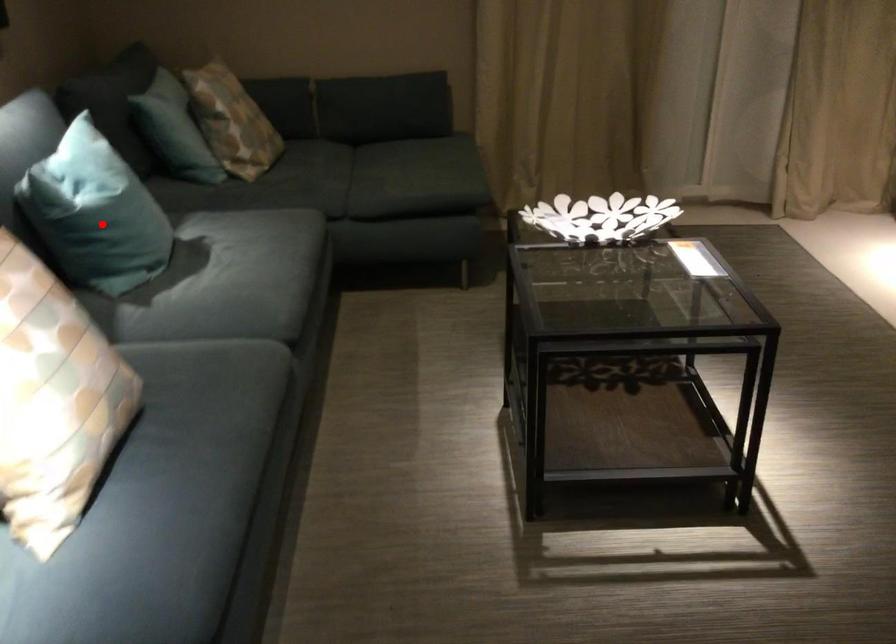
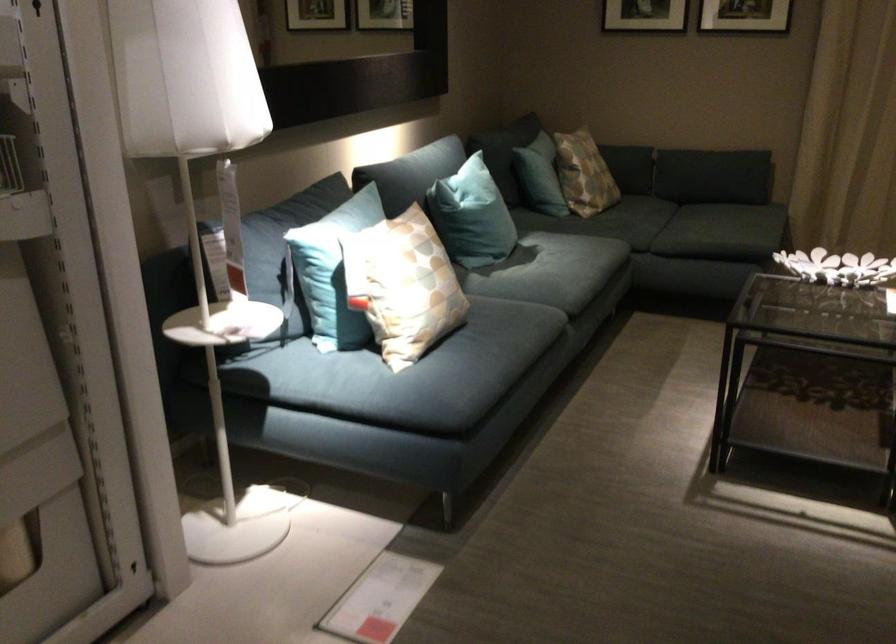
Question: A red point is marked in image1. In image2, is the corresponding 3D point closer to the camera or farther? Reply with the corresponding letter.

Choices:
 (A) The corresponding 3D point is closer.
 (B) The corresponding 3D point is farther.

Answer: (B)